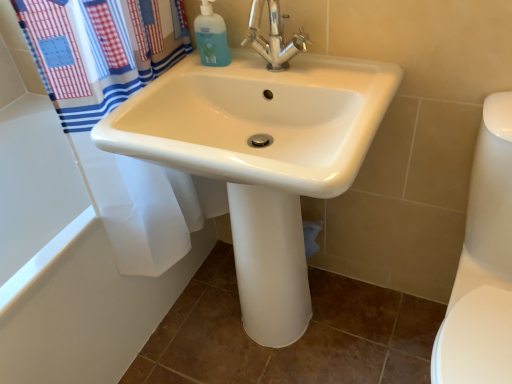
Where is `free area in between polished chrome faucet at center and translucent plastic bottle at upper center`? free area in between polished chrome faucet at center and translucent plastic bottle at upper center is located at coordinates (234, 72).